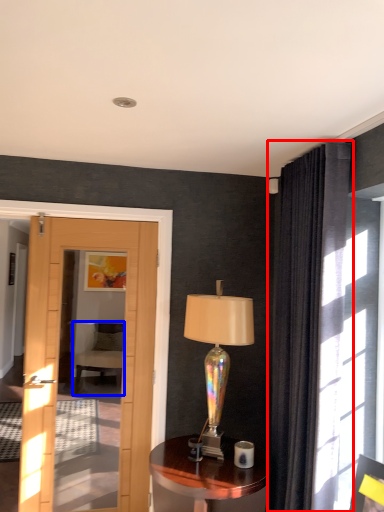
Question: Which object is further to the camera taking this photo, curtain (highlighted by a red box) or chair (highlighted by a blue box)?

Choices:
 (A) curtain
 (B) chair

Answer: (B)